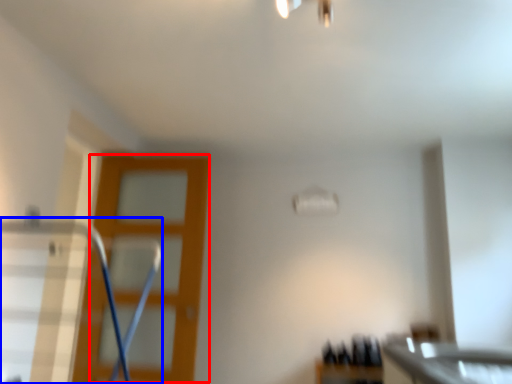
Question: Which object appears closest to the camera in this image, screen door (highlighted by a red box) or swivel chair (highlighted by a blue box)?

Choices:
 (A) screen door
 (B) swivel chair

Answer: (B)